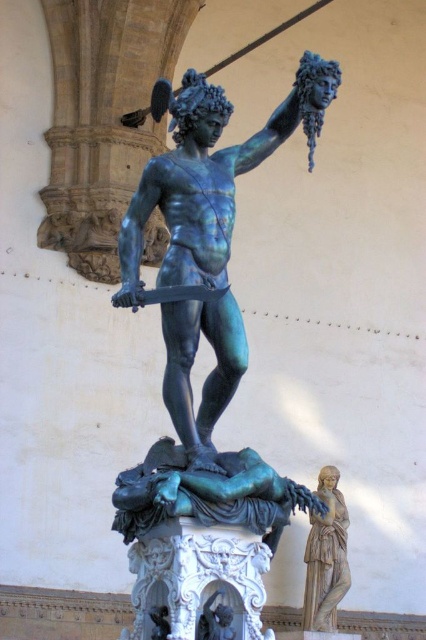
Question: Which object is farther from the camera taking this photo?

Choices:
 (A) smooth beige statue at right
 (B) bronze warrior at center

Answer: (A)

Question: Considering the relative positions of bronze warrior at center and smooth beige statue at right in the image provided, where is bronze warrior at center located with respect to smooth beige statue at right?

Choices:
 (A) below
 (B) above

Answer: (B)

Question: Is bronze warrior at center further to the viewer compared to smooth beige statue at right?

Choices:
 (A) no
 (B) yes

Answer: (A)

Question: From the image, what is the correct spatial relationship of bronze warrior at center in relation to smooth beige statue at right?

Choices:
 (A) right
 (B) left

Answer: (B)